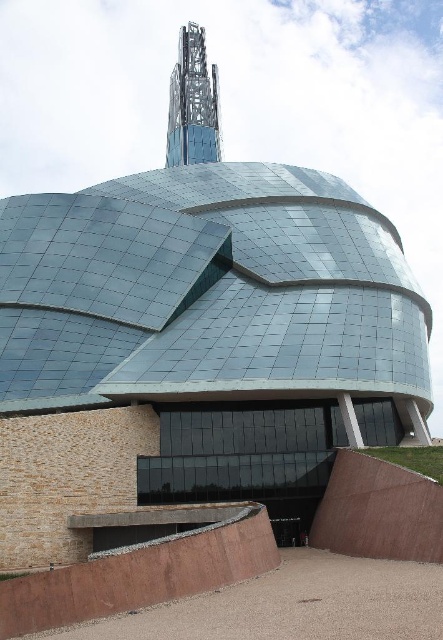
Who is more forward, (x=357, y=461) or (x=174, y=129)?

Point (x=357, y=461) is more forward.

Who is lower down, brown textured ramp at lower center or glassy steel tower at upper center?

brown textured ramp at lower center is below.

What do you see at coordinates (379, 509) in the screenshot? The image size is (443, 640). I see `brown textured ramp at lower center` at bounding box center [379, 509].

Find the location of a particular element. The width and height of the screenshot is (443, 640). brown textured ramp at lower center is located at coordinates (379, 509).

Can you confirm if brown concrete ramp at lower center is positioned above glassy steel tower at upper center?

No, brown concrete ramp at lower center is not above glassy steel tower at upper center.

Is brown concrete ramp at lower center in front of glassy steel tower at upper center?

Yes, it is in front of glassy steel tower at upper center.

Locate an element on the screen. This screenshot has width=443, height=640. brown concrete ramp at lower center is located at coordinates [x=139, y=577].

At what (x,y) coordinates should I click in order to perform the action: click on brown concrete ramp at lower center. Please return your answer as a coordinate pair (x, y). This screenshot has width=443, height=640. Looking at the image, I should click on (139, 577).

Does brown concrete ramp at lower center appear on the right side of brown textured ramp at lower center?

In fact, brown concrete ramp at lower center is to the left of brown textured ramp at lower center.

Who is lower down, brown concrete ramp at lower center or brown textured ramp at lower center?

brown concrete ramp at lower center is lower down.

You are a GUI agent. You are given a task and a screenshot of the screen. Output one action in this format:
    pyautogui.click(x=<x>, y=<y>)
    Task: Click on the brown concrete ramp at lower center
    
    Given the screenshot: What is the action you would take?
    pyautogui.click(x=139, y=577)